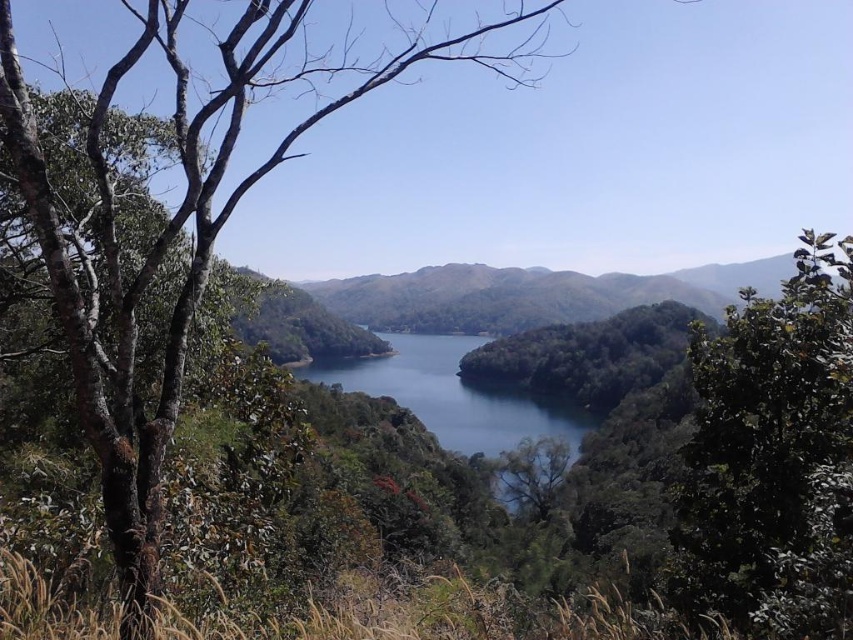
The image size is (853, 640). What do you see at coordinates (157, 257) in the screenshot?
I see `green leafy tree at left` at bounding box center [157, 257].

Which is below, green leafy tree at left or green matte mountain at center?

Positioned lower is green matte mountain at center.

Is point (138, 534) farther from camera compared to point (454, 307)?

No, it is not.

The height and width of the screenshot is (640, 853). Identify the location of green leafy tree at left. (157, 257).

Consider the image. Is green leafy tree at right smaller than dark green leafy tree at center?

Indeed, green leafy tree at right has a smaller size compared to dark green leafy tree at center.

Is green leafy tree at right bigger than dark green leafy tree at center?

Incorrect, green leafy tree at right is not larger than dark green leafy tree at center.

Who is more distant from viewer, (718,506) or (666,326)?

Positioned behind is point (666,326).

The height and width of the screenshot is (640, 853). I want to click on green leafy tree at right, so click(x=775, y=456).

Who is more distant from viewer, (148, 540) or (538, 381)?

Point (538, 381)

Between green leafy tree at left and dark green leafy tree at center, which one appears on the right side from the viewer's perspective?

dark green leafy tree at center

Image resolution: width=853 pixels, height=640 pixels. I want to click on green leafy tree at left, so click(x=157, y=257).

Find the location of a particular element. The width and height of the screenshot is (853, 640). green leafy tree at left is located at coordinates (157, 257).